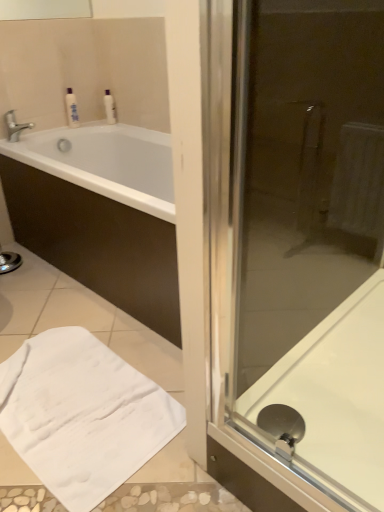
Question: Can you confirm if white glossy bottle at upper left, which is the 2th toiletry from left to right, is positioned to the right of white glossy bath at right?

Choices:
 (A) no
 (B) yes

Answer: (A)

Question: Is white glossy bottle at upper left, acting as the 1th toiletry starting from the right, not near white glossy bath at right?

Choices:
 (A) no
 (B) yes

Answer: (B)

Question: Is white glossy bottle at upper left, acting as the 1th toiletry starting from the right, further to the viewer compared to white glossy bath at right?

Choices:
 (A) no
 (B) yes

Answer: (B)

Question: Are white glossy bottle at upper left, acting as the 1th toiletry starting from the right, and white glossy bath at right beside each other?

Choices:
 (A) no
 (B) yes

Answer: (A)

Question: Does white glossy bottle at upper left, which is the 2th toiletry from left to right, have a larger size compared to white glossy bath at right?

Choices:
 (A) no
 (B) yes

Answer: (A)

Question: Is silver metallic faucet at upper left wider or thinner than white glossy bathtub at upper left?

Choices:
 (A) thin
 (B) wide

Answer: (A)

Question: Visually, is silver metallic faucet at upper left positioned to the left or to the right of white glossy bathtub at upper left?

Choices:
 (A) left
 (B) right

Answer: (A)

Question: Is silver metallic faucet at upper left bigger or smaller than white glossy bathtub at upper left?

Choices:
 (A) big
 (B) small

Answer: (B)

Question: From their relative heights in the image, would you say silver metallic faucet at upper left is taller or shorter than white glossy bathtub at upper left?

Choices:
 (A) short
 (B) tall

Answer: (A)

Question: From a real-world perspective, relative to silver metallic faucet at upper left, is white glossy bathtub at upper left vertically above or below?

Choices:
 (A) below
 (B) above

Answer: (A)

Question: From the image's perspective, relative to silver metallic faucet at upper left, is white glossy bathtub at upper left above or below?

Choices:
 (A) below
 (B) above

Answer: (A)

Question: Based on their sizes in the image, would you say white glossy bathtub at upper left is bigger or smaller than silver metallic faucet at upper left?

Choices:
 (A) big
 (B) small

Answer: (A)

Question: Is white glossy bathtub at upper left taller or shorter than silver metallic faucet at upper left?

Choices:
 (A) tall
 (B) short

Answer: (A)

Question: From a real-world perspective, relative to white glossy bottle at upper left, which is the 2th toiletry from left to right, is white soft towel at lower left vertically above or below?

Choices:
 (A) below
 (B) above

Answer: (A)

Question: Is white soft towel at lower left in front of or behind white glossy bottle at upper left, acting as the 1th toiletry starting from the right, in the image?

Choices:
 (A) behind
 (B) front

Answer: (B)